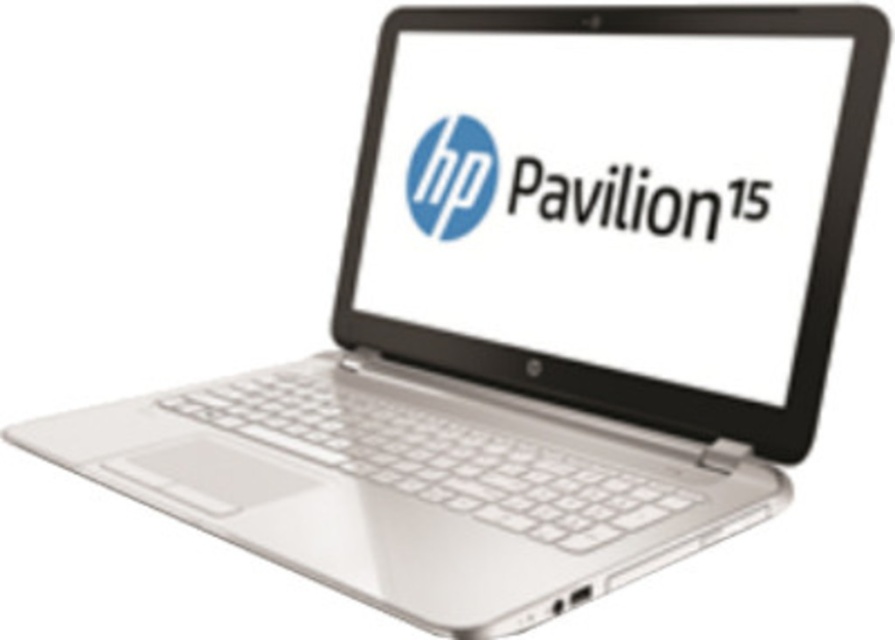
Who is more distant from viewer, (631, 246) or (430, 140)?

The point (430, 140) is more distant.

Does silver glossy laptop screen at center have a greater width compared to matte plastic logo at center?

Correct, the width of silver glossy laptop screen at center exceeds that of matte plastic logo at center.

Find the location of a particular element. This screenshot has width=895, height=640. silver glossy laptop screen at center is located at coordinates (612, 188).

Can you confirm if silver glossy laptop screen at center is bigger than matte black laptop at center?

Yes.

From the picture: Can you confirm if silver glossy laptop screen at center is positioned above matte black laptop at center?

Correct, silver glossy laptop screen at center is located above matte black laptop at center.

I want to click on silver glossy laptop screen at center, so click(612, 188).

Find the location of a particular element. matte black laptop at center is located at coordinates (634, 198).

Between matte black laptop at center and matte plastic logo at center, which one is positioned higher?

matte plastic logo at center is higher up.

Locate an element on the screen. The image size is (895, 640). matte black laptop at center is located at coordinates (634, 198).

This screenshot has width=895, height=640. In order to click on matte black laptop at center in this screenshot , I will do `click(634, 198)`.